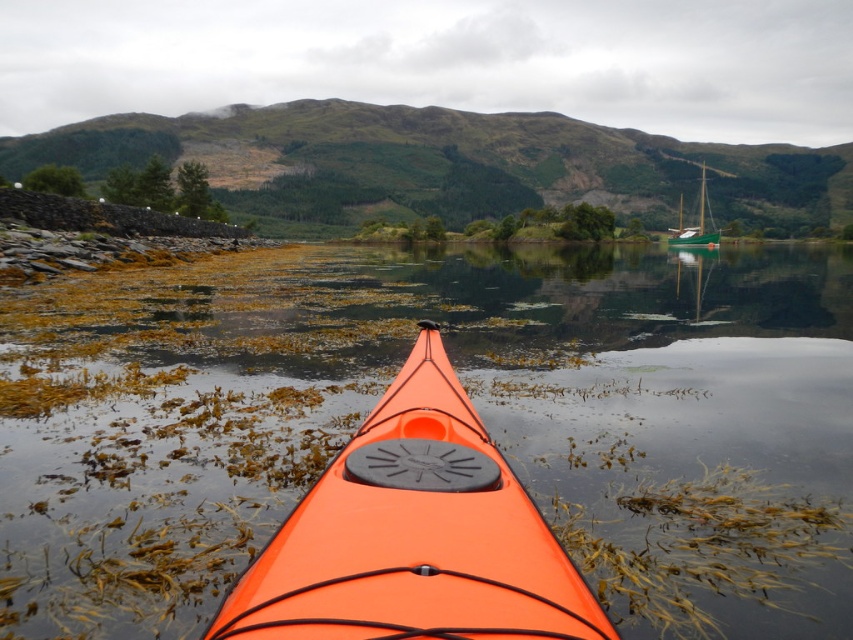
Question: Does orange matte kayak at center lie behind green glossy sailboat at right?

Choices:
 (A) no
 (B) yes

Answer: (A)

Question: Which is nearer to the green glossy sailboat at right?

Choices:
 (A) orange matte kayak at center
 (B) translucent seaweed at center

Answer: (B)

Question: Is translucent seaweed at center closer to camera compared to green glossy sailboat at right?

Choices:
 (A) yes
 (B) no

Answer: (A)

Question: Is translucent seaweed at center positioned behind green glossy sailboat at right?

Choices:
 (A) yes
 (B) no

Answer: (B)

Question: Among these objects, which one is nearest to the camera?

Choices:
 (A) green glossy sailboat at right
 (B) orange matte kayak at center
 (C) translucent seaweed at center

Answer: (B)

Question: Which object appears closest to the camera in this image?

Choices:
 (A) orange matte kayak at center
 (B) translucent seaweed at center

Answer: (A)